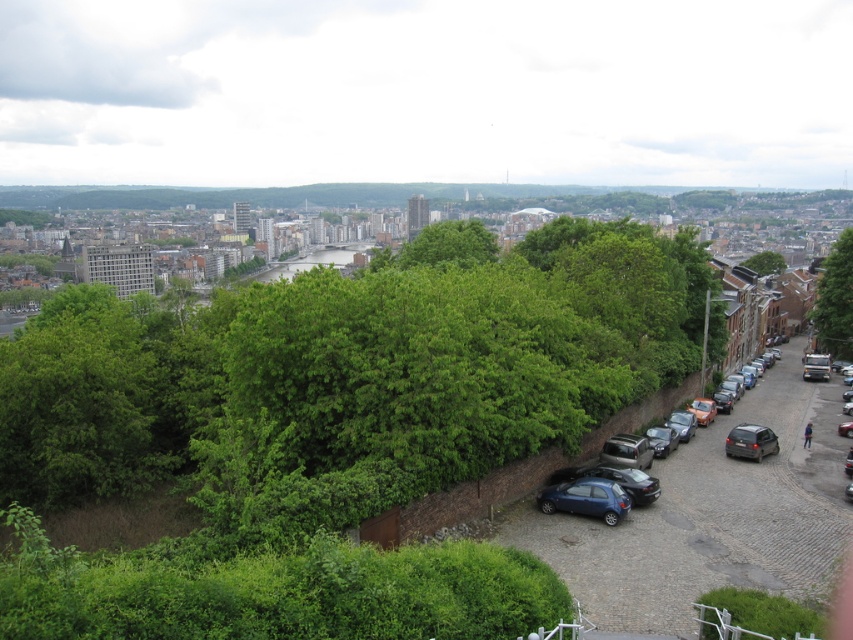
Can you confirm if green leafy tree at center is positioned below matte black car at lower right?

Incorrect, green leafy tree at center is not positioned below matte black car at lower right.

Which is below, green leafy tree at center or matte black car at lower right?

matte black car at lower right is below.

You are a GUI agent. You are given a task and a screenshot of the screen. Output one action in this format:
    pyautogui.click(x=<x>, y=<y>)
    Task: Click on the green leafy tree at center
    
    Given the screenshot: What is the action you would take?
    pyautogui.click(x=347, y=378)

Which is in front, point (846, 301) or point (776, 253)?

Point (846, 301) is in front.

Is green leafy tree at right shorter than green leafy tree at upper right?

Incorrect, green leafy tree at right's height does not fall short of green leafy tree at upper right's.

Describe the element at coordinates (834, 300) in the screenshot. I see `green leafy tree at right` at that location.

Find the location of a particular element. This screenshot has height=640, width=853. green leafy tree at right is located at coordinates (834, 300).

Does matte black car at lower right have a lesser height compared to satin black car at lower right?

In fact, matte black car at lower right may be taller than satin black car at lower right.

Which of these two, matte black car at lower right or satin black car at lower right, stands taller?

matte black car at lower right

The height and width of the screenshot is (640, 853). Describe the element at coordinates (610, 477) in the screenshot. I see `matte black car at lower right` at that location.

Locate an element on the screen. The image size is (853, 640). matte black car at lower right is located at coordinates (610, 477).